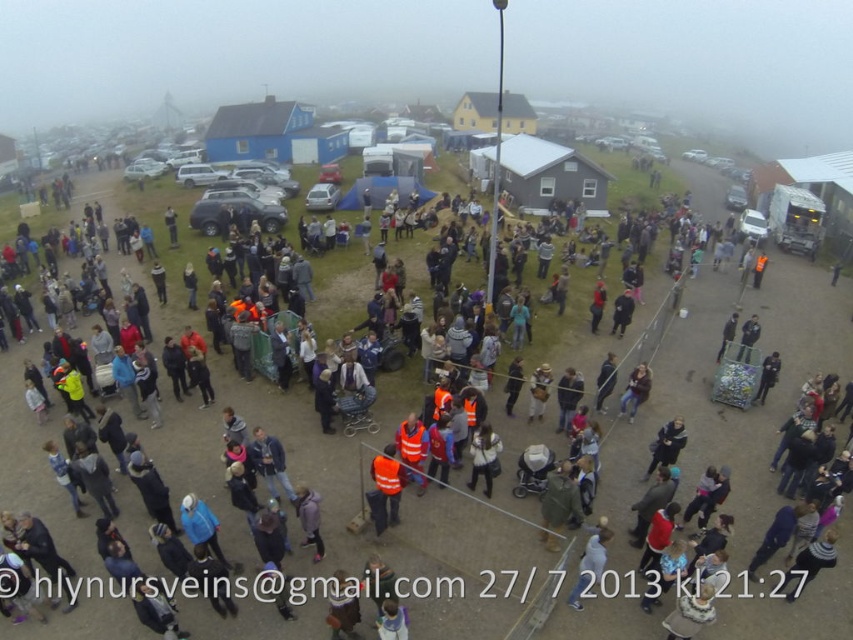
You are a photographer standing at the edge of the crowd, and you want to take a photo that includes both the white fabric jacket at center and the leather jacket at center. Given that your camera has a maximum focus range of 5 meters, will you be able to capture both jackets in focus without moving closer?

The white fabric jacket at center and leather jacket at center are 5.83 meters apart from each other. Since the distance between them exceeds the camera maximum focus range of 5 meters, you will not be able to capture both jackets in focus without moving closer.

You are a photographer trying to capture a photo of both the white fabric jacket at lower center and the leather jacket at center. Based on their heights, which jacket should you focus on first to ensure both are in frame?

The white fabric jacket at lower center is taller than the leather jacket at center, so you should focus on the white fabric jacket at lower center first to ensure both are in frame.